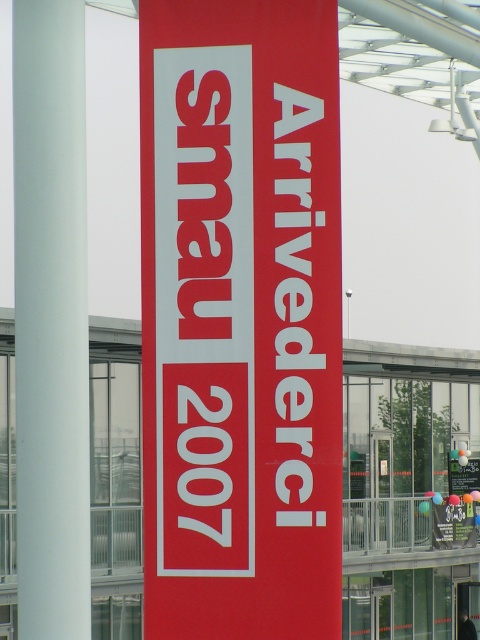
Which is more to the right, matte red banner at center or white smooth pole at left?

matte red banner at center is more to the right.

Is point (191, 179) closer to viewer compared to point (78, 477)?

No, (191, 179) is behind (78, 477).

Who is more distant from viewer, (x=169, y=257) or (x=60, y=88)?

Positioned behind is point (x=169, y=257).

At what (x,y) coordinates should I click in order to perform the action: click on matte red banner at center. Please return your answer as a coordinate pair (x, y). The width and height of the screenshot is (480, 640). Looking at the image, I should click on (240, 317).